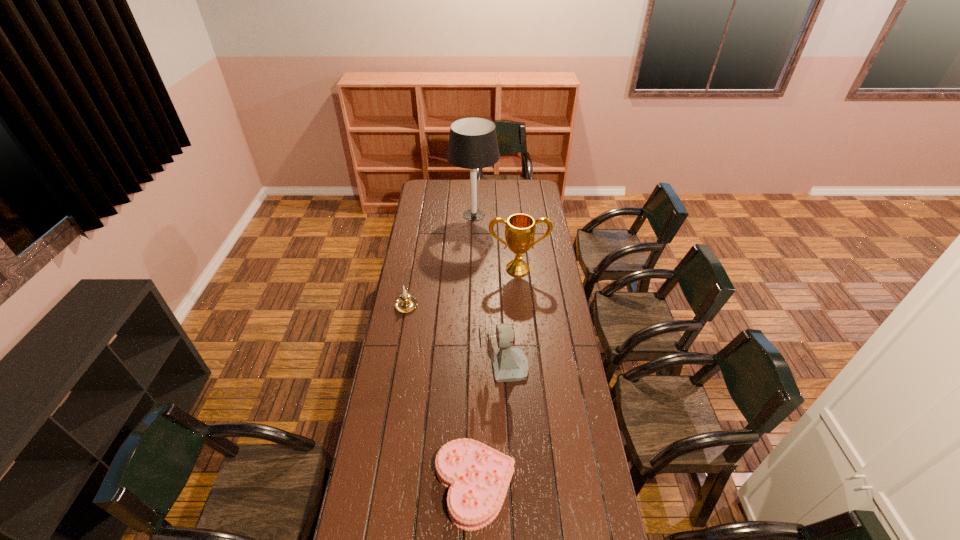
Where is `free space at the left edge of the desktop`? This screenshot has width=960, height=540. free space at the left edge of the desktop is located at coordinates (377, 538).

You are a GUI agent. You are given a task and a screenshot of the screen. Output one action in this format:
    pyautogui.click(x=<x>, y=<y>)
    Task: Click on the free space at the right edge of the desktop
    
    Given the screenshot: What is the action you would take?
    pyautogui.click(x=578, y=405)

The height and width of the screenshot is (540, 960). Find the location of `empty space between the farthest object and the candle holder`. empty space between the farthest object and the candle holder is located at coordinates point(441,259).

Locate an element on the screen. This screenshot has height=540, width=960. vacant region between the second shortest object and the tallest object is located at coordinates (441, 259).

You are a GUI agent. You are given a task and a screenshot of the screen. Output one action in this format:
    pyautogui.click(x=<x>, y=<y>)
    Task: Click on the free space between the tallest object and the award
    
    Given the screenshot: What is the action you would take?
    pyautogui.click(x=495, y=242)

Image resolution: width=960 pixels, height=540 pixels. I want to click on empty location between the second shortest object and the nearest object, so click(441, 395).

Where is `free spot between the farthest object and the nearest object`? Image resolution: width=960 pixels, height=540 pixels. free spot between the farthest object and the nearest object is located at coordinates (474, 350).

Image resolution: width=960 pixels, height=540 pixels. I want to click on vacant space that is in between the fourth nearest object and the fan, so click(x=511, y=319).

You are a GUI agent. You are given a task and a screenshot of the screen. Output one action in this format:
    pyautogui.click(x=<x>, y=<y>)
    Task: Click on the unoccupied area between the second nearest object and the table lamp
    The width and height of the screenshot is (960, 540).
    Given the screenshot: What is the action you would take?
    pyautogui.click(x=489, y=292)

Select which object is the closest to the third farthest object. Please provide its 2D coordinates. Your answer should be formatted as a tuple, i.e. [(x, y)], where the tuple contains the x and y coordinates of a point satisfying the conditions above.

[(508, 364)]